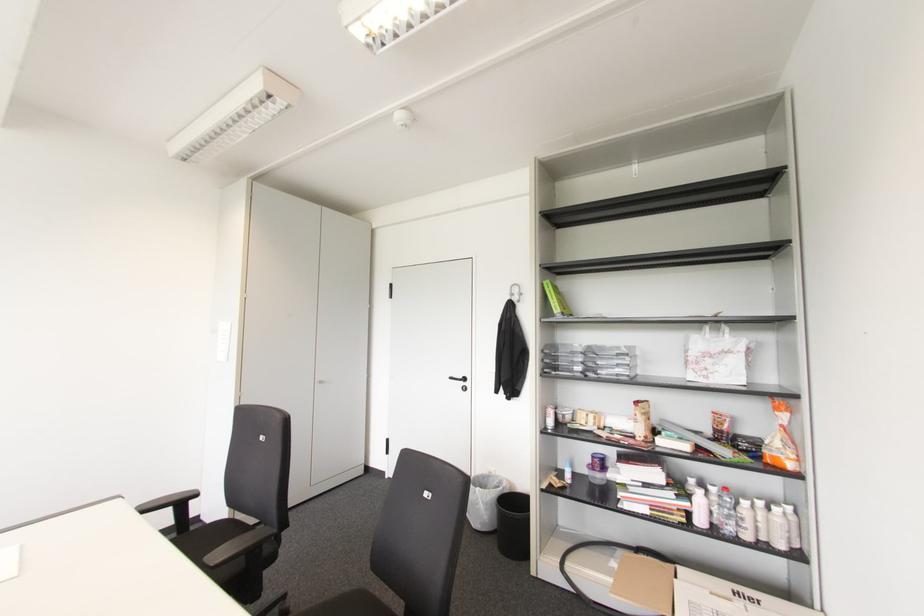
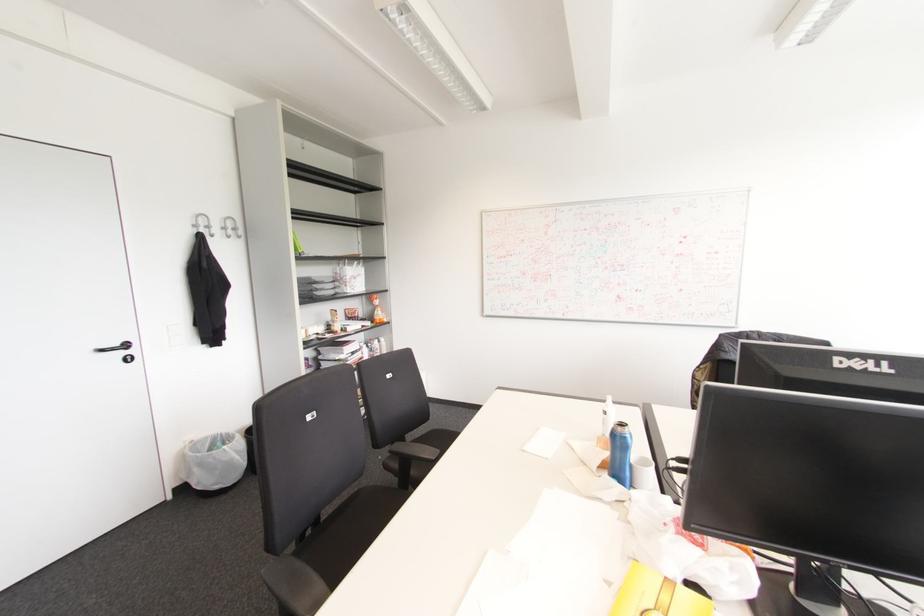
Where in the second image is the point corresponding to (464,379) from the first image?

(126, 345)